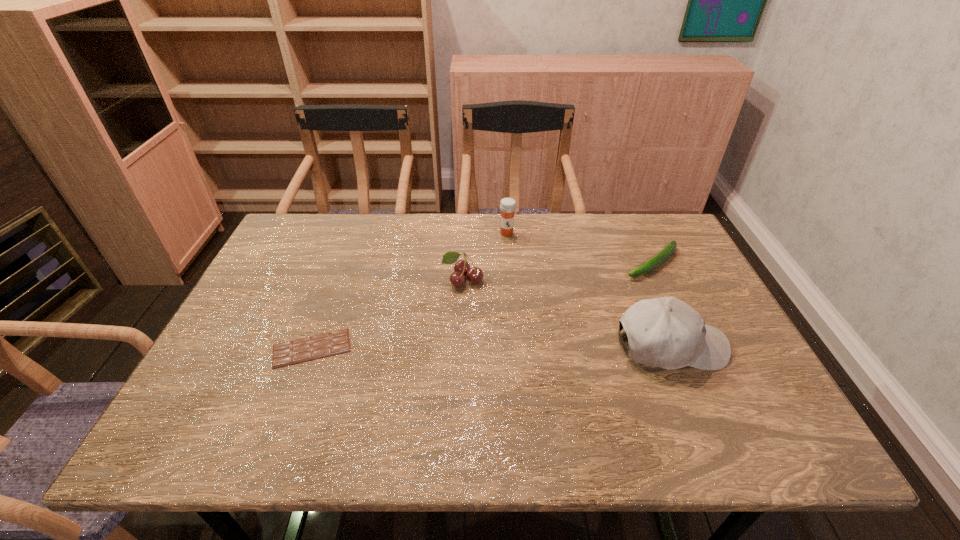
Where is `free space on the desktop that is between the leftmost object and the baseball cap and is positioned on the label side of the medicine`? free space on the desktop that is between the leftmost object and the baseball cap and is positioned on the label side of the medicine is located at coordinates (511, 347).

Locate an element on the screen. Image resolution: width=960 pixels, height=540 pixels. vacant spot on the desktop that is between the shortest object and the baseball cap and is positioned on the leaves of the third tallest object is located at coordinates (444, 347).

Locate an element on the screen. Image resolution: width=960 pixels, height=540 pixels. vacant space on the desktop that is between the leftmost object and the baseball cap and is positioned on the front-facing side of the fourth tallest object is located at coordinates (534, 347).